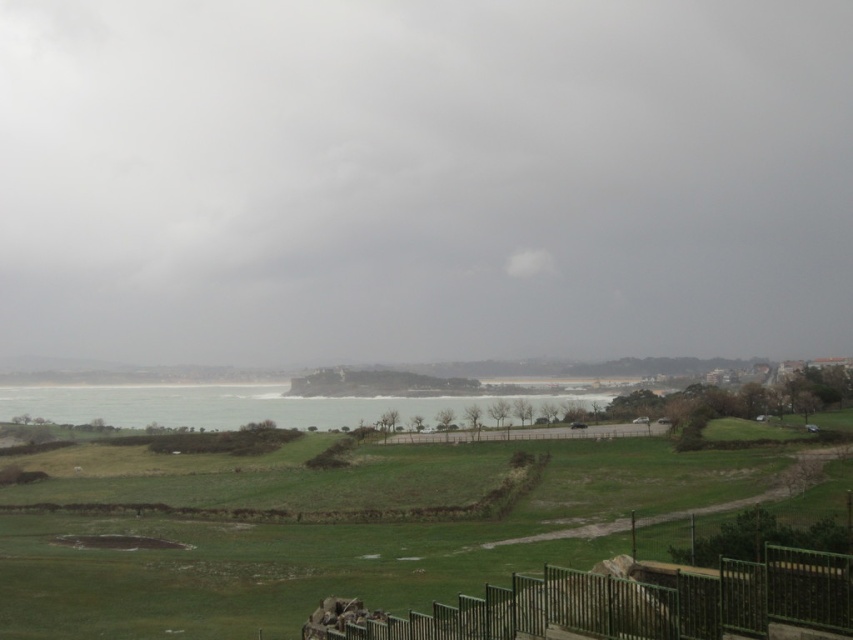
You are a photographer planning to capture the coastal landscape. You want to ensure the gray cloudy sky at upper center and the green metal fence at lower center are both visible in your shot. Given their sizes, which object should you focus on to frame the scene appropriately?

The gray cloudy sky at upper center is larger than the green metal fence at lower center, so focusing on the gray cloudy sky at upper center will help frame the scene appropriately while still including the green metal fence at lower center in the composition.

You are standing at the viewpoint looking out at the coastal landscape. You notice the gray cloudy sky at upper center and the green metal fence at lower center. Which object is wider from your perspective?

The gray cloudy sky at upper center might be wider than green metal fence at lower center.

From the picture: You are planning to install a weather station that requires a clear vertical space of at least 80 meters between the gray cloudy sky at upper center and the green water at center. Based on the scene, will the vertical space between them meet the requirement?

The vertical space between the gray cloudy sky at upper center and the green water at center is 75.87 meters, which is less than the required 80 meters. Therefore, the vertical space does not meet the requirement.